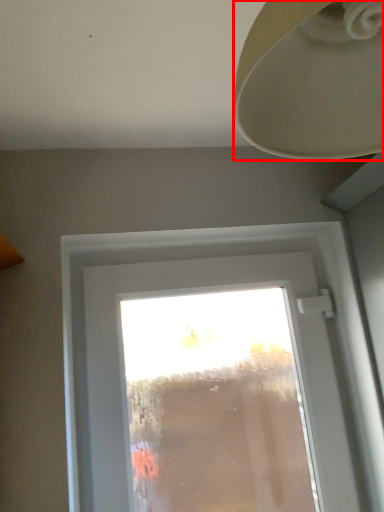
Question: From the image's perspective, where is lamp (annotated by the red box) located in relation to window in the image?

Choices:
 (A) above
 (B) below

Answer: (A)